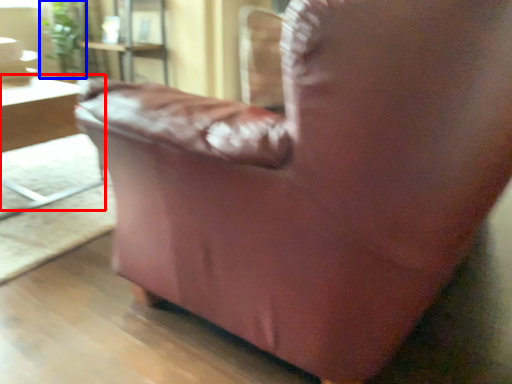
Question: Among these objects, which one is nearest to the camera, table (highlighted by a red box) or plant (highlighted by a blue box)?

Choices:
 (A) table
 (B) plant

Answer: (A)